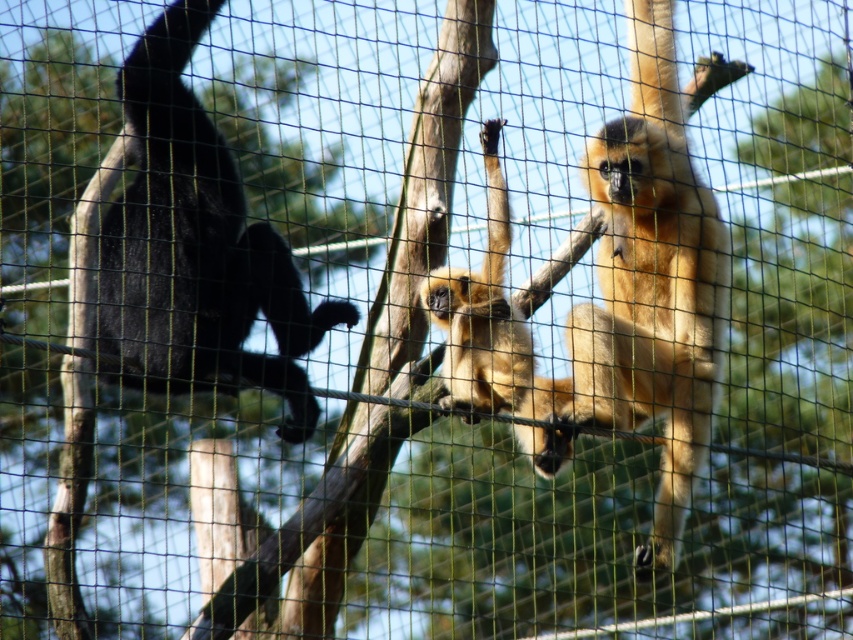
Which of these two, shiny black monkey at left or golden fur monkey at center, stands taller?

Standing taller between the two is shiny black monkey at left.

Who is positioned more to the left, shiny black monkey at left or golden fur monkey at center?

Positioned to the left is shiny black monkey at left.

Which is in front, point (328, 323) or point (460, 358)?

Point (328, 323)

Where is `shiny black monkey at left`? shiny black monkey at left is located at coordinates (195, 248).

Can you confirm if golden fur monkey at right is wider than golden fur monkey at center?

No, golden fur monkey at right is not wider than golden fur monkey at center.

Is golden fur monkey at right bigger than golden fur monkey at center?

No.

Locate an element on the screen. This screenshot has width=853, height=640. golden fur monkey at right is located at coordinates (645, 292).

Which is below, golden fur monkey at right or shiny black monkey at left?

Positioned lower is golden fur monkey at right.

Between golden fur monkey at right and shiny black monkey at left, which one appears on the right side from the viewer's perspective?

Positioned to the right is golden fur monkey at right.

Is point (670, 497) in front of point (262, 280)?

No, (670, 497) is behind (262, 280).

In order to click on golden fur monkey at right in this screenshot , I will do `click(645, 292)`.